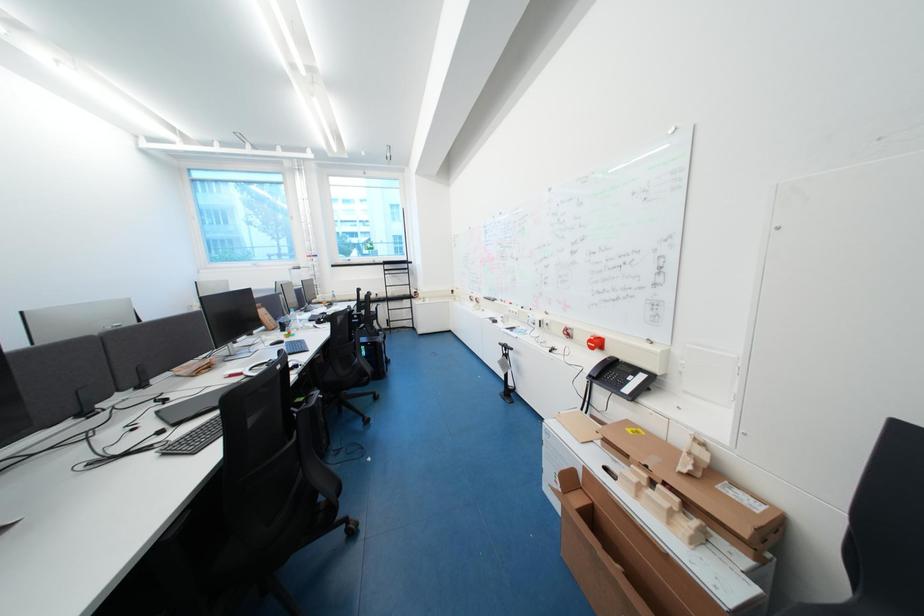
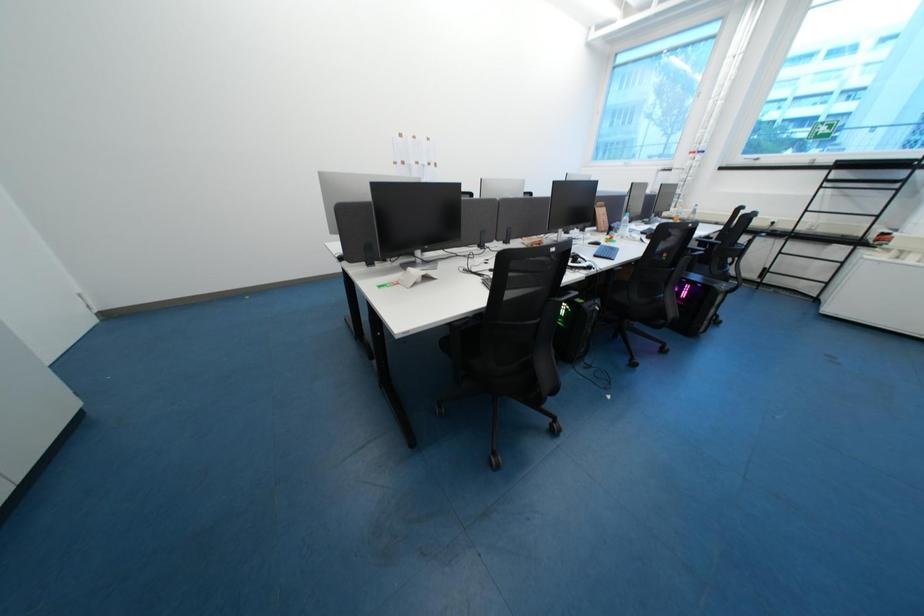
The images are taken continuously from a first-person perspective. In which direction is your viewpoint rotating?

The camera's rotation is toward left-down.